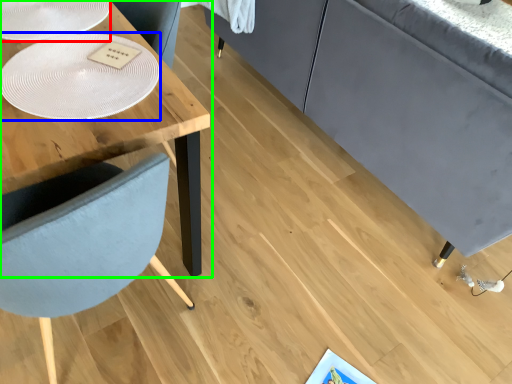
Question: Estimate the real-world distances between objects in this image. Which object is closer to glass plate (highlighted by a red box), glass plate (highlighted by a blue box) or table (highlighted by a green box)?

Choices:
 (A) glass plate
 (B) table

Answer: (B)